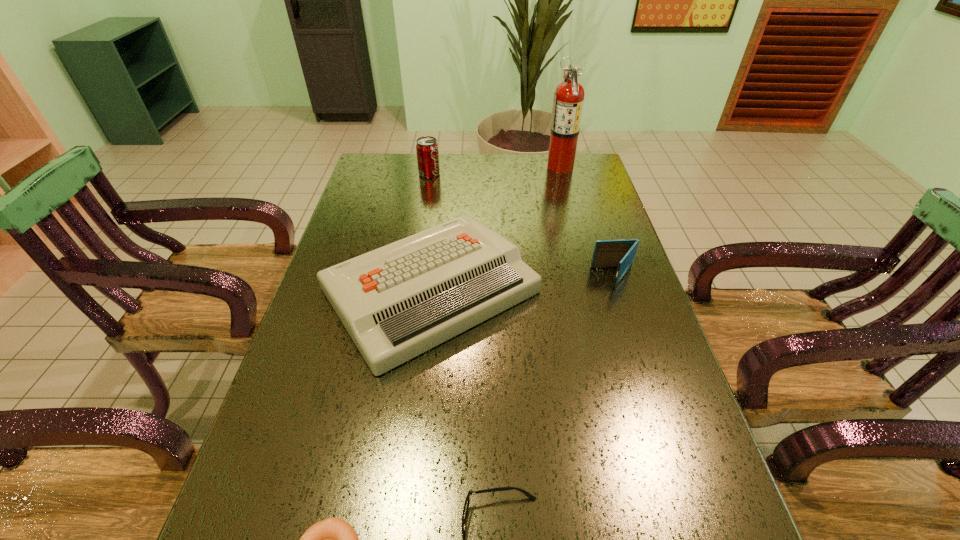
The width and height of the screenshot is (960, 540). I want to click on vacant space at the right edge, so click(564, 216).

Locate an element on the screen. The height and width of the screenshot is (540, 960). unoccupied area between the wallet and the pop soda is located at coordinates 522,226.

The height and width of the screenshot is (540, 960). Find the location of `free space that is in between the wallet and the fire extinguisher`. free space that is in between the wallet and the fire extinguisher is located at coordinates (588, 221).

Locate an element on the screen. object that is the third nearest to the pop soda is located at coordinates (607, 253).

Select which object appears as the fifth closest to the pop soda. Please provide its 2D coordinates. Your answer should be formatted as a tuple, i.e. [(x, y)], where the tuple contains the x and y coordinates of a point satisfying the conditions above.

[(332, 539)]